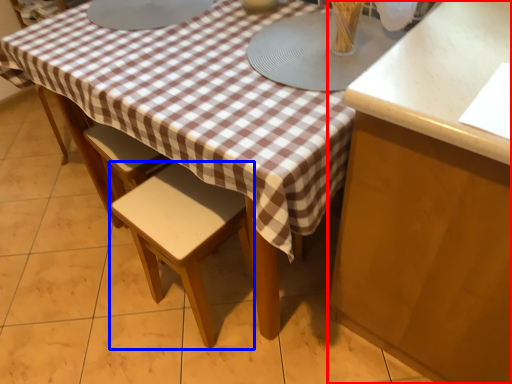
Question: Which object is further to the camera taking this photo, cabinetry (highlighted by a red box) or stool (highlighted by a blue box)?

Choices:
 (A) cabinetry
 (B) stool

Answer: (B)